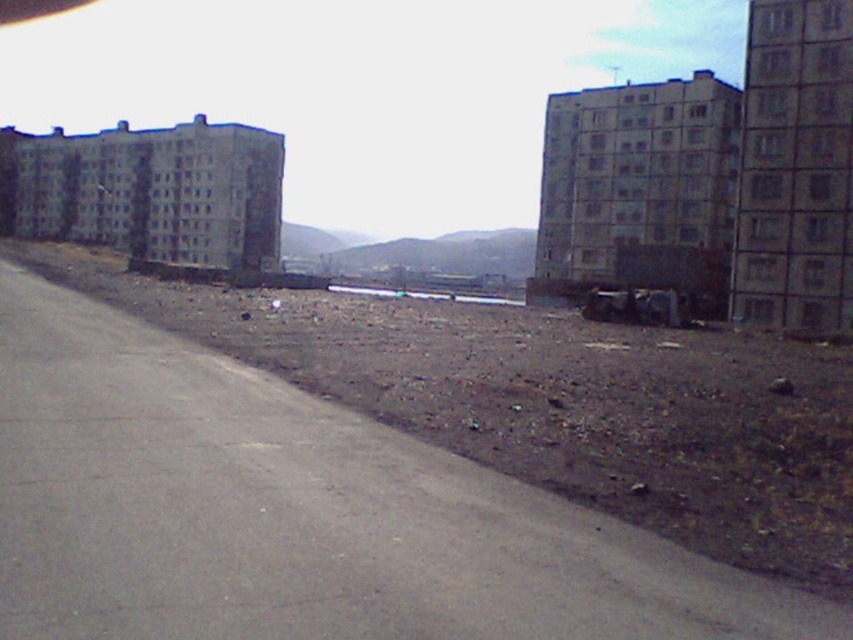
You are a city planner analyzing the urban layout. Given the brown dirt at lower left and the gray concrete building at upper right, which one occupies more space in the image?

The brown dirt at lower left is larger in size than the gray concrete building at upper right, so it occupies more space in the image.

You are a delivery drone that needs to land in the brown dirt at lower left. The gray concrete building at upper right has a height of 30 meters. Can you safely descend vertically without hitting the building?

The brown dirt at lower left is 45.56 meters away from the gray concrete building at upper right. Since the building is 30 meters tall, the drone can safely descend vertically as the horizontal distance is greater than the building height.

You are a delivery person trying to find a parking spot in the urban area shown. You see the brown dirt at lower left and the gray concrete building at upper right. Which location is closer to you as you stand at the edge of the road?

The brown dirt at lower left is closer to you because it is in front of the gray concrete building at upper right, meaning it is between you and the building.